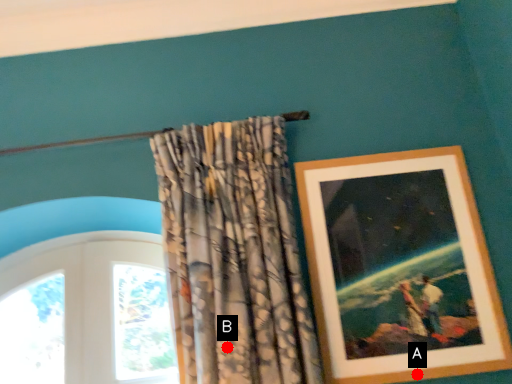
Question: Two points are circled on the image, labeled by A and B beside each circle. Which of the following is the farthest from the observer?

Choices:
 (A) A is further
 (B) B is further

Answer: (A)